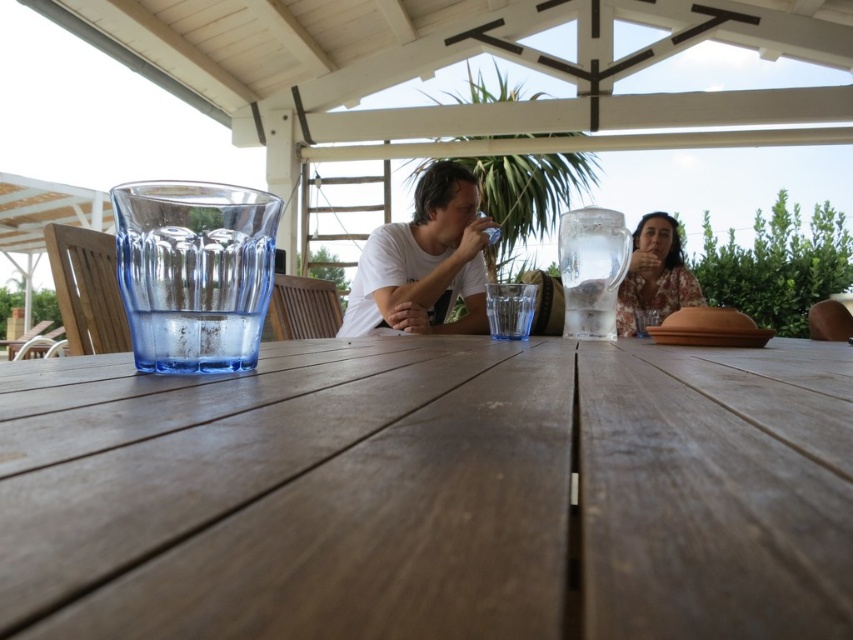
You are standing in front of the wooden table and want to place a small flower vase between the two points marked as point [219,499] and point [566,269]. Which point should the vase be closer to in order to be nearer to the camera?

The vase should be placed closer to point [219,499] because it is closer to the camera than point [566,269].